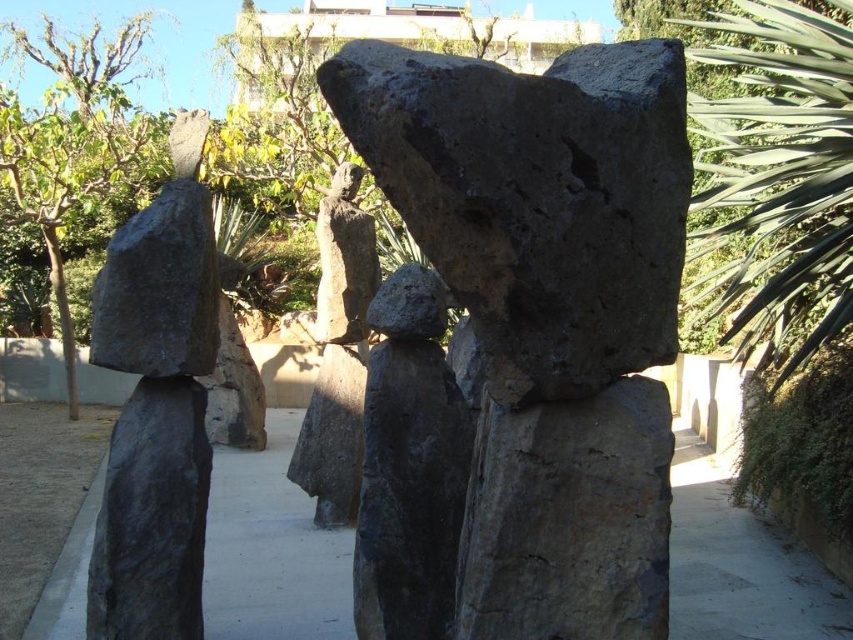
Question: Can you confirm if dark gray stone boulder at center is smaller than dark gray stone boulder at left?

Choices:
 (A) yes
 (B) no

Answer: (B)

Question: Is dark gray stone boulder at center smaller than dark gray stone boulder at left?

Choices:
 (A) yes
 (B) no

Answer: (B)

Question: Which point is farther to the camera?

Choices:
 (A) (339, 356)
 (B) (164, 232)
 (C) (274, 563)

Answer: (A)

Question: Among these points, which one is farthest from the camera?

Choices:
 (A) (190, 310)
 (B) (349, 516)
 (C) (627, 228)

Answer: (B)

Question: Can you confirm if dark gray stone path at center is thinner than dark gray stone boulder at left?

Choices:
 (A) yes
 (B) no

Answer: (B)

Question: Which point is farther to the camera?

Choices:
 (A) (125, 285)
 (B) (322, 476)
 (C) (316, 618)
 (D) (473, 172)

Answer: (B)